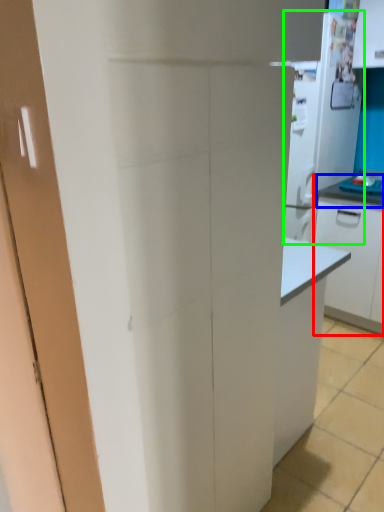
Question: Based on their relative distances, which object is nearer to cabinetry (highlighted by a red box)? Choose from countertop (highlighted by a blue box) and appliance (highlighted by a green box).

Choices:
 (A) countertop
 (B) appliance

Answer: (A)